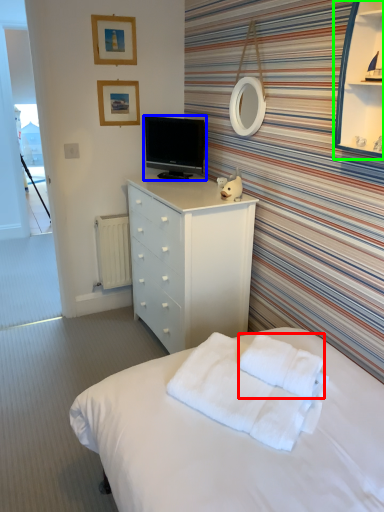
Question: Which is farther away from cloth (highlighted by a red box)? television (highlighted by a blue box) or cabinet (highlighted by a green box)?

Choices:
 (A) television
 (B) cabinet

Answer: (A)